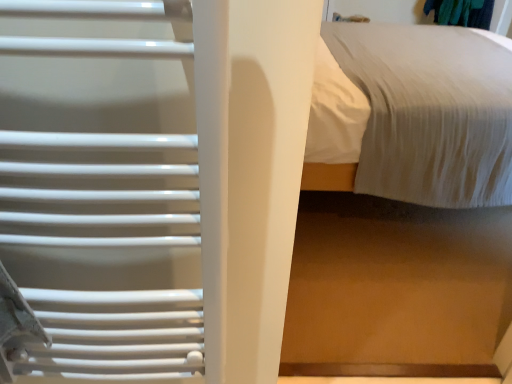
Question: Is white matte radiator at left closer to camera compared to white textured bed at upper right, which is the second bed in front-to-back order?

Choices:
 (A) no
 (B) yes

Answer: (B)

Question: Is white matte radiator at left aimed at white textured bed at upper right, which is the second bed in front-to-back order?

Choices:
 (A) no
 (B) yes

Answer: (A)

Question: Is white matte radiator at left positioned far away from white textured bed at upper right, positioned as the first bed in back-to-front order?

Choices:
 (A) yes
 (B) no

Answer: (A)

Question: Can you confirm if white matte radiator at left is bigger than white textured bed at upper right, which is the second bed in front-to-back order?

Choices:
 (A) no
 (B) yes

Answer: (A)

Question: Is white matte radiator at left positioned with its back to white textured bed at upper right, positioned as the first bed in back-to-front order?

Choices:
 (A) no
 (B) yes

Answer: (A)

Question: From a real-world perspective, relative to white textured bed at upper right, which is the second bed in front-to-back order, is white matte radiator at left vertically above or below?

Choices:
 (A) above
 (B) below

Answer: (A)

Question: Looking at their shapes, would you say white matte radiator at left is wider or thinner than white textured bed at upper right, which is the second bed in front-to-back order?

Choices:
 (A) wide
 (B) thin

Answer: (B)

Question: In terms of size, does white matte radiator at left appear bigger or smaller than white textured bed at upper right, positioned as the first bed in back-to-front order?

Choices:
 (A) small
 (B) big

Answer: (A)

Question: Is white matte radiator at left in front of or behind white textured bed at upper right, which is the second bed in front-to-back order, in the image?

Choices:
 (A) behind
 (B) front

Answer: (B)

Question: From the image's perspective, relative to white textured bed at center, the 2th bed viewed from the back, is white textured bed at upper right, which is the second bed in front-to-back order, above or below?

Choices:
 (A) below
 (B) above

Answer: (B)

Question: Looking at the image, does white textured bed at upper right, which is the second bed in front-to-back order, seem bigger or smaller compared to white textured bed at center, marked as the 1th bed in a front-to-back arrangement?

Choices:
 (A) big
 (B) small

Answer: (A)

Question: Is point (387, 188) positioned closer to the camera than point (360, 77)?

Choices:
 (A) closer
 (B) farther

Answer: (A)

Question: Would you say white textured bed at upper right, which is the second bed in front-to-back order, is to the left or to the right of white textured bed at center, marked as the 1th bed in a front-to-back arrangement, in the picture?

Choices:
 (A) left
 (B) right

Answer: (B)

Question: Is white textured bed at center, the 2th bed viewed from the back, situated inside white textured bed at upper right, positioned as the first bed in back-to-front order, or outside?

Choices:
 (A) outside
 (B) inside

Answer: (A)

Question: From the image's perspective, is white textured bed at center, the 2th bed viewed from the back, located above or below white textured bed at upper right, which is the second bed in front-to-back order?

Choices:
 (A) below
 (B) above

Answer: (A)